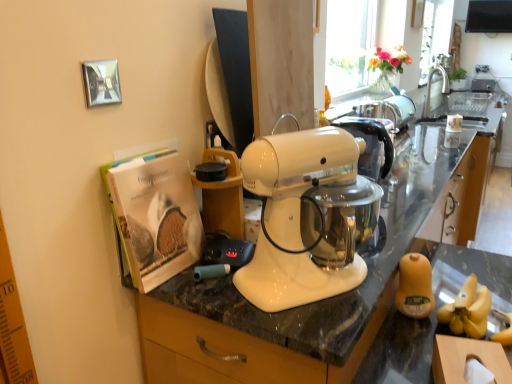
Question: Is white glossy countertop at center thinner than yellow matte jar at lower right?

Choices:
 (A) no
 (B) yes

Answer: (A)

Question: From the image's perspective, is white glossy countertop at center located above yellow matte jar at lower right?

Choices:
 (A) yes
 (B) no

Answer: (B)

Question: Is white glossy countertop at center outside yellow matte jar at lower right?

Choices:
 (A) no
 (B) yes

Answer: (B)

Question: Is white glossy countertop at center positioned far away from yellow matte jar at lower right?

Choices:
 (A) no
 (B) yes

Answer: (A)

Question: Is white glossy countertop at center at the right side of yellow matte jar at lower right?

Choices:
 (A) yes
 (B) no

Answer: (A)

Question: Is silver metallic faucet at upper right taller or shorter than white glossy countertop at center?

Choices:
 (A) tall
 (B) short

Answer: (B)

Question: Looking at the image, does silver metallic faucet at upper right seem bigger or smaller compared to white glossy countertop at center?

Choices:
 (A) small
 (B) big

Answer: (A)

Question: Relative to white glossy countertop at center, is silver metallic faucet at upper right in front or behind?

Choices:
 (A) front
 (B) behind

Answer: (B)

Question: Does point (445, 69) appear closer or farther from the camera than point (275, 329)?

Choices:
 (A) farther
 (B) closer

Answer: (A)

Question: In terms of height, does matte paper magazine at left look taller or shorter compared to silver metallic faucet at upper right?

Choices:
 (A) tall
 (B) short

Answer: (B)

Question: From a real-world perspective, is matte paper magazine at left physically located above or below silver metallic faucet at upper right?

Choices:
 (A) above
 (B) below

Answer: (B)

Question: Relative to silver metallic faucet at upper right, is matte paper magazine at left in front or behind?

Choices:
 (A) behind
 (B) front

Answer: (B)

Question: Based on their sizes in the image, would you say matte paper magazine at left is bigger or smaller than silver metallic faucet at upper right?

Choices:
 (A) big
 (B) small

Answer: (B)

Question: From a real-world perspective, is silver metallic faucet at upper right above or below yellow matte jar at lower right?

Choices:
 (A) above
 (B) below

Answer: (A)

Question: Relative to yellow matte jar at lower right, is silver metallic faucet at upper right in front or behind?

Choices:
 (A) behind
 (B) front

Answer: (A)